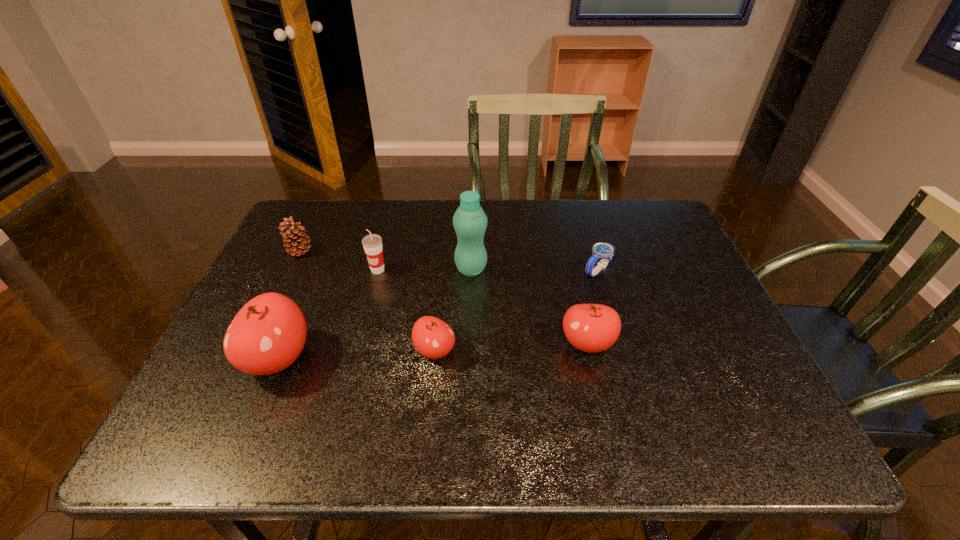
Find the location of `vacant area that lies between the rightmost apple and the second apple from left to right`. vacant area that lies between the rightmost apple and the second apple from left to right is located at coordinates (511, 347).

Image resolution: width=960 pixels, height=540 pixels. I want to click on unoccupied position between the bottle and the second tallest apple, so click(529, 306).

Find the location of `vacant area that lies between the cup and the second shortest apple`. vacant area that lies between the cup and the second shortest apple is located at coordinates (483, 307).

Locate an element on the screen. The height and width of the screenshot is (540, 960). free space between the pinecone and the shortest object is located at coordinates (449, 261).

This screenshot has height=540, width=960. I want to click on empty location between the shortest object and the bottle, so click(x=535, y=269).

The image size is (960, 540). Find the location of `object that stands as the closest to the watch`. object that stands as the closest to the watch is located at coordinates (592, 328).

This screenshot has height=540, width=960. What are the coordinates of `object that is the sixth closest to the pinecone` in the screenshot? It's located at (600, 250).

You are a GUI agent. You are given a task and a screenshot of the screen. Output one action in this format:
    pyautogui.click(x=<x>, y=<y>)
    Task: Click on the apple that is the closest to the second apple from left to right
    
    Given the screenshot: What is the action you would take?
    pyautogui.click(x=267, y=335)

Identify the location of the second closest apple relative to the shortest object. (433, 338).

What are the coordinates of `free spot that satisfies the following two spatial constraints: 1. on the side of the second shortest apple with the logo; 2. on the right side of the third object from left to right` in the screenshot? It's located at click(x=359, y=343).